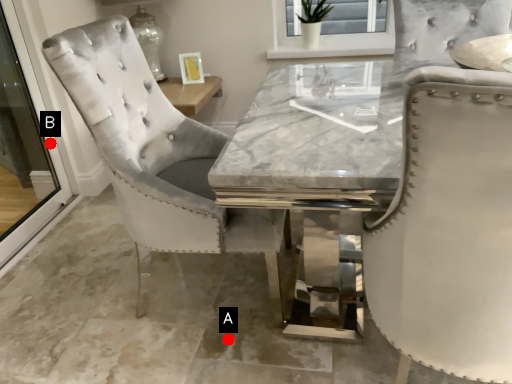
Question: Two points are circled on the image, labeled by A and B beside each circle. Which point appears farthest from the camera in this image?

Choices:
 (A) A is further
 (B) B is further

Answer: (B)